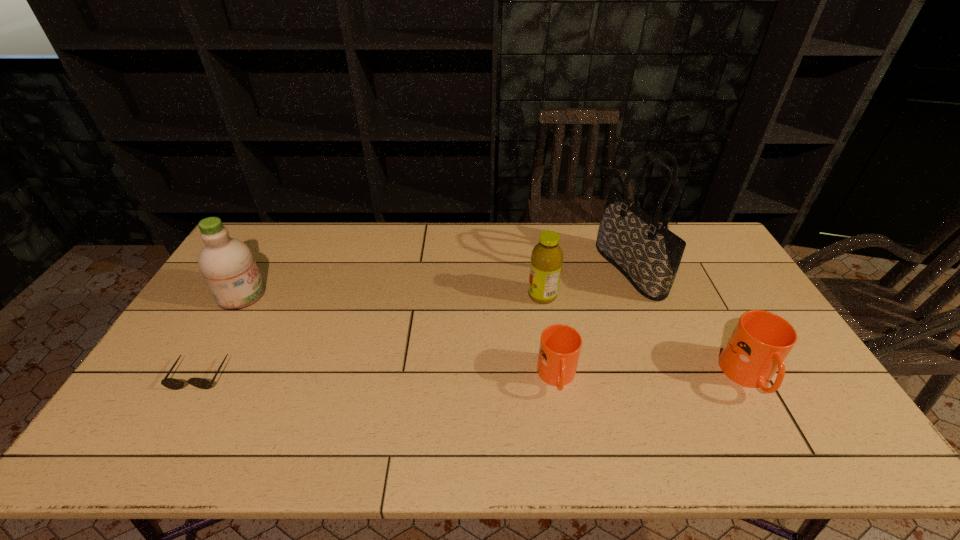
The height and width of the screenshot is (540, 960). I want to click on object that is at the near left corner, so click(171, 383).

The width and height of the screenshot is (960, 540). Identify the location of object that is at the near right corner. (760, 342).

Locate an element on the screen. Image resolution: width=960 pixels, height=540 pixels. blank area at the far edge is located at coordinates [409, 235].

Identify the location of blank space at the near edge of the desktop. This screenshot has height=540, width=960. (558, 400).

Find the location of `free space at the left edge of the desktop`. free space at the left edge of the desktop is located at coordinates (236, 315).

This screenshot has height=540, width=960. Identify the location of vacant space at the right edge of the desktop. (699, 267).

Locate an element on the screen. This screenshot has height=540, width=960. free space between the fourth shortest object and the shortest object is located at coordinates (372, 335).

Where is `free space between the second object from right to left and the fourth shortest object`? The height and width of the screenshot is (540, 960). free space between the second object from right to left and the fourth shortest object is located at coordinates (586, 283).

Identify the location of vacant space that is in between the fruit juice and the taller mug. (646, 336).

At what (x,y) coordinates should I click in order to perform the action: click on vacant point located between the left mug and the taller mug. Please return your answer as a coordinate pair (x, y). Looking at the image, I should click on (653, 377).